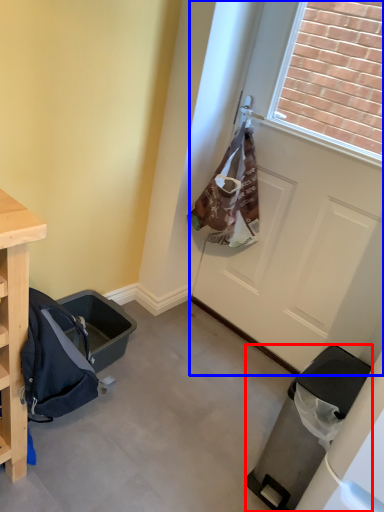
Question: Which object is further to the camera taking this photo, trash bin/can (highlighted by a red box) or door (highlighted by a blue box)?

Choices:
 (A) trash bin/can
 (B) door

Answer: (B)